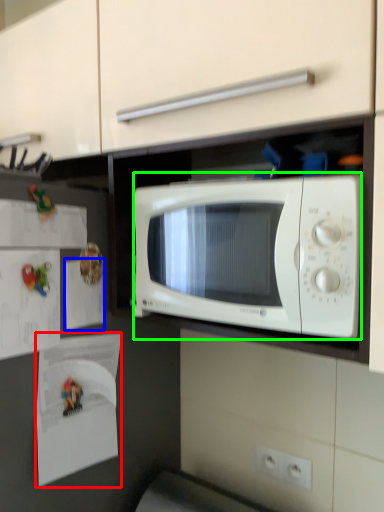
Question: Which object is positioned closest to paper (highlighted by a red box)? Select from paper (highlighted by a blue box) and microwave oven (highlighted by a green box).

Choices:
 (A) paper
 (B) microwave oven

Answer: (A)